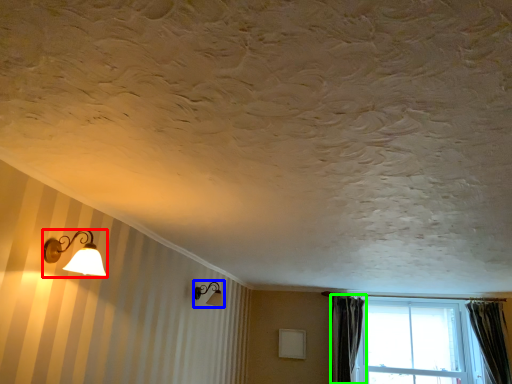
Question: Which is nearer to the lamp (highlighted by a red box)? lamp (highlighted by a blue box) or curtain (highlighted by a green box).

Choices:
 (A) lamp
 (B) curtain

Answer: (A)